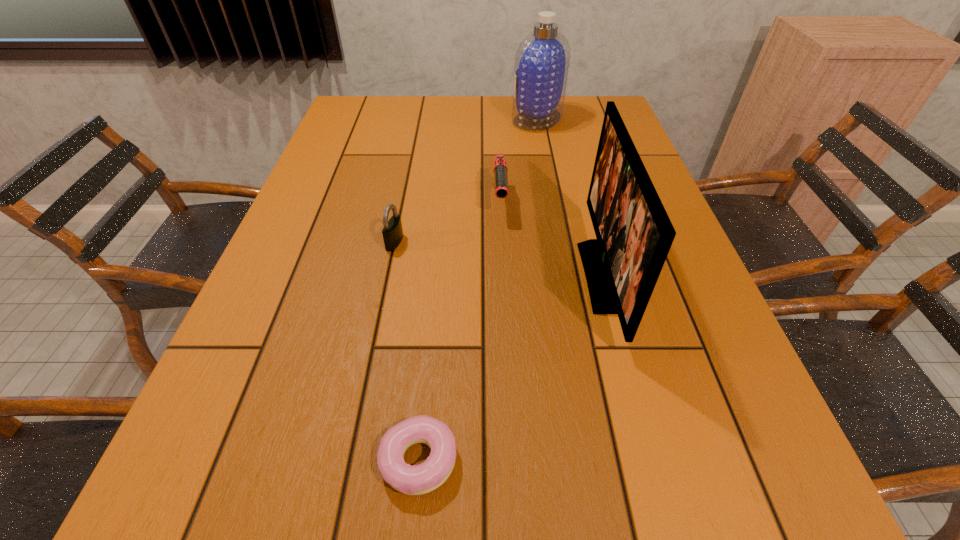
Find the location of a particular element. This screenshot has width=960, height=540. free region located at the aiming end of the gun is located at coordinates (505, 314).

This screenshot has width=960, height=540. What are the coordinates of `free space located 0.070m on the left of the padlock` in the screenshot? It's located at (357, 242).

Where is `vacant space located 0.340m on the back of the doughnut`? vacant space located 0.340m on the back of the doughnut is located at coordinates (437, 273).

I want to click on object located in the far edge section of the desktop, so click(542, 60).

You are a GUI agent. You are given a task and a screenshot of the screen. Output one action in this format:
    pyautogui.click(x=<x>, y=<y>)
    Task: Click on the object positioned at the near edge
    This screenshot has width=960, height=540.
    Given the screenshot: What is the action you would take?
    (x=420, y=479)

I want to click on object positioned at the right edge, so click(x=634, y=234).

Where is `free location at the far edge of the desktop`? This screenshot has width=960, height=540. free location at the far edge of the desktop is located at coordinates (499, 110).

Locate an element on the screen. The image size is (960, 540). free space at the left edge of the desktop is located at coordinates (348, 192).

Image resolution: width=960 pixels, height=540 pixels. I want to click on vacant space at the right edge of the desktop, so click(695, 431).

Identify the location of vacant space at the far left corner. The width and height of the screenshot is (960, 540). (368, 129).